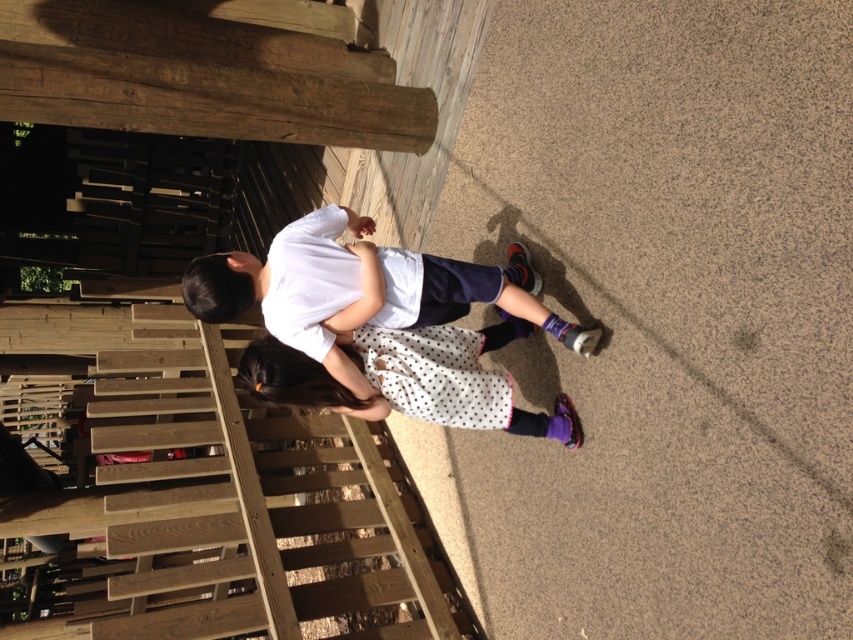
Question: Can you confirm if white matte shirt at center is thinner than white dotted dress at center?

Choices:
 (A) no
 (B) yes

Answer: (A)

Question: Does white matte shirt at center have a greater width compared to white dotted dress at center?

Choices:
 (A) no
 (B) yes

Answer: (B)

Question: Where is white matte shirt at center located in relation to white dotted dress at center in the image?

Choices:
 (A) right
 (B) left

Answer: (B)

Question: Which of the following is the closest to the observer?

Choices:
 (A) white matte shirt at center
 (B) white dotted dress at center

Answer: (A)